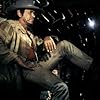
At what (x,y) coordinates should I click in order to perform the action: click on light. Please return your answer as a coordinate pair (x, y). The height and width of the screenshot is (100, 100). Looking at the image, I should click on (91, 23).